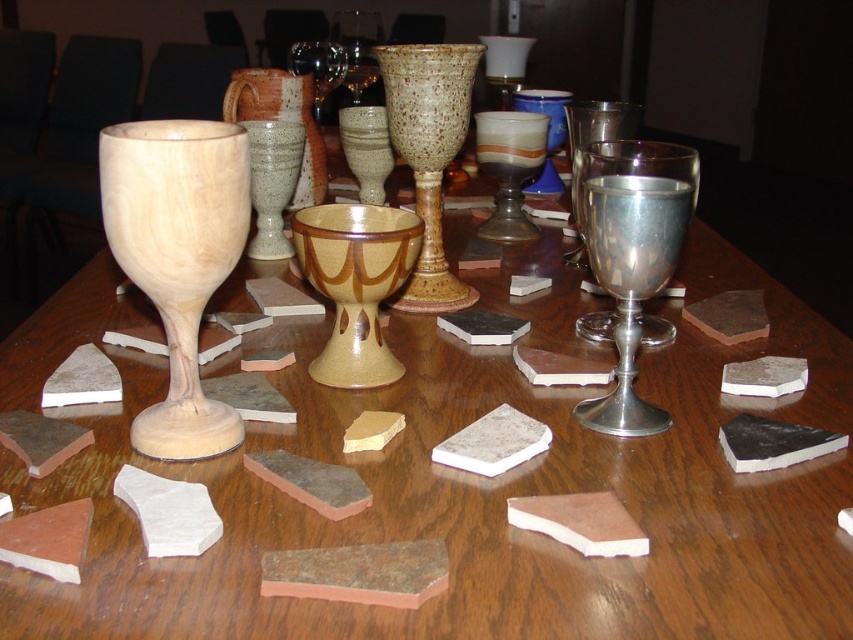
Question: Does speckled ceramic chalice at center come in front of matte ceramic goblet at center?

Choices:
 (A) no
 (B) yes

Answer: (B)

Question: Which object is the farthest from the matte ceramic wine glass at center?

Choices:
 (A) speckled ceramic goblet at center
 (B) brown speckled ceramic goblet at center
 (C) speckled ceramic chalice at center

Answer: (B)

Question: Does brown speckled ceramic goblet at center have a lesser width compared to matte ceramic goblet at center?

Choices:
 (A) yes
 (B) no

Answer: (A)

Question: Which object is the farthest from the speckled ceramic goblet at center?

Choices:
 (A) shiny metallic goblet at center-right
 (B) matte ceramic goblet at center
 (C) speckled ceramic chalice at center

Answer: (B)

Question: Does shiny metallic goblet at center-right appear on the left side of matte ceramic goblet at center?

Choices:
 (A) yes
 (B) no

Answer: (B)

Question: Which point appears farthest from the camera in this image?

Choices:
 (A) (x=314, y=80)
 (B) (x=165, y=241)

Answer: (A)